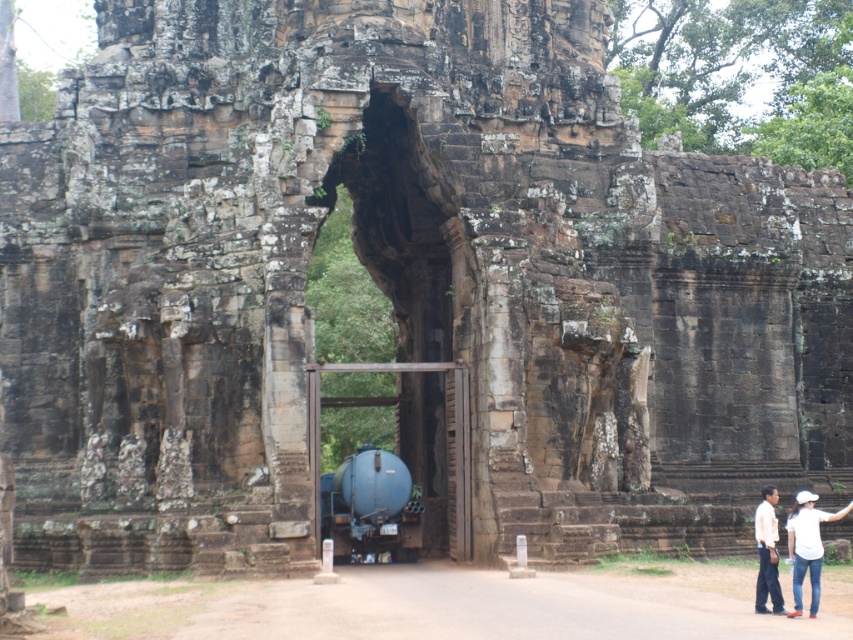
Can you confirm if blue metallic tank at center is bigger than white cotton shirt at lower right?

Indeed, blue metallic tank at center has a larger size compared to white cotton shirt at lower right.

Is blue metallic tank at center in front of white cotton shirt at lower right?

No.

What do you see at coordinates (318, 408) in the screenshot?
I see `blue metallic tank at center` at bounding box center [318, 408].

At what (x,y) coordinates should I click in order to perform the action: click on blue metallic tank at center. Please return your answer as a coordinate pair (x, y). The width and height of the screenshot is (853, 640). Looking at the image, I should click on (318, 408).

Is blue metallic tank at center below white shirt at lower right?

Actually, blue metallic tank at center is above white shirt at lower right.

Is the position of blue metallic tank at center less distant than that of white shirt at lower right?

No, blue metallic tank at center is further to the viewer.

Where is `blue metallic tank at center`? The image size is (853, 640). blue metallic tank at center is located at coordinates (318, 408).

Is white cotton shirt at lower right smaller than white shirt at lower right?

No, white cotton shirt at lower right is not smaller than white shirt at lower right.

Between point (813, 600) and point (770, 588), which one is positioned in front?

Point (813, 600) is more forward.

Between point (798, 540) and point (761, 602), which one is positioned in front?

Positioned in front is point (761, 602).

The image size is (853, 640). I want to click on white cotton shirt at lower right, so click(807, 547).